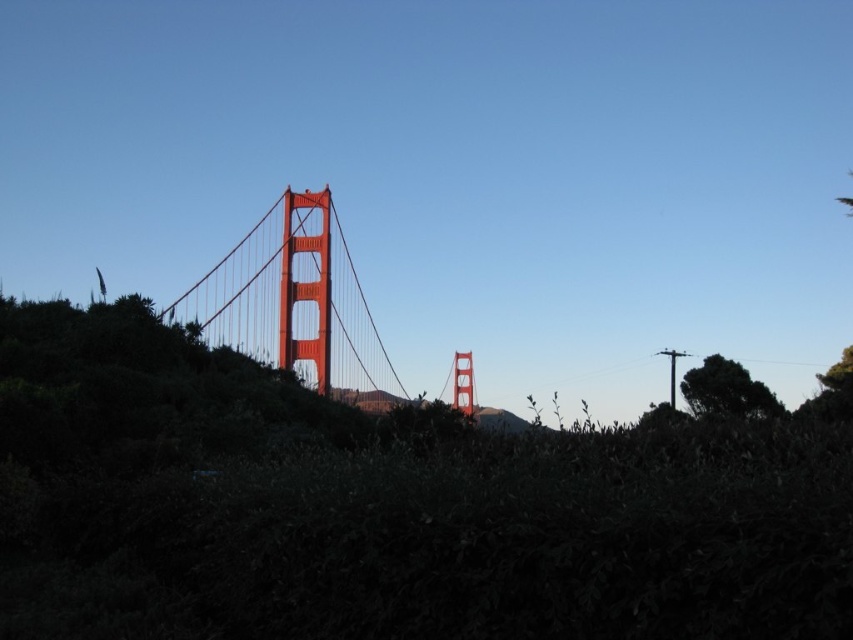
Question: Is glossy steel bridge at center further to camera compared to green leafy tree at right?

Choices:
 (A) no
 (B) yes

Answer: (B)

Question: Does glossy steel bridge at center come behind green leafy tree at right?

Choices:
 (A) yes
 (B) no

Answer: (A)

Question: Which of the following is the closest to the observer?

Choices:
 (A) green leafy tree at right
 (B) glossy steel bridge at center

Answer: (A)

Question: Which of the following is the closest to the observer?

Choices:
 (A) (206, 288)
 (B) (734, 365)

Answer: (B)

Question: Is glossy steel bridge at center bigger than green leafy tree at right?

Choices:
 (A) no
 (B) yes

Answer: (B)